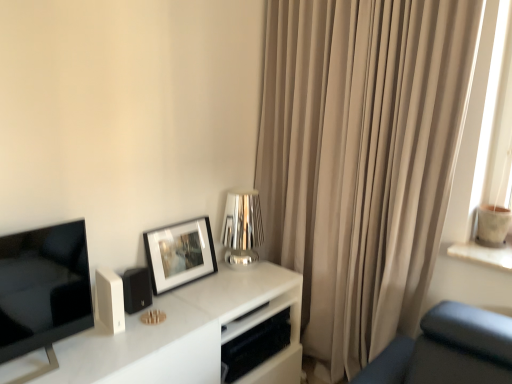
Question: Could you tell me if shiny metallic table lamp at center is facing white marble tv stand at center?

Choices:
 (A) yes
 (B) no

Answer: (B)

Question: Does shiny metallic table lamp at center have a greater width compared to white marble tv stand at center?

Choices:
 (A) yes
 (B) no

Answer: (B)

Question: Does shiny metallic table lamp at center appear on the left side of white marble tv stand at center?

Choices:
 (A) yes
 (B) no

Answer: (B)

Question: Is white marble tv stand at center completely or partially inside shiny metallic table lamp at center?

Choices:
 (A) no
 (B) yes

Answer: (A)

Question: From the image's perspective, does shiny metallic table lamp at center appear lower than white marble tv stand at center?

Choices:
 (A) yes
 (B) no

Answer: (B)

Question: Is white marble tv stand at center taller or shorter than beige fabric curtain at right?

Choices:
 (A) tall
 (B) short

Answer: (B)

Question: From a real-world perspective, is white marble tv stand at center positioned above or below beige fabric curtain at right?

Choices:
 (A) above
 (B) below

Answer: (B)

Question: From the image's perspective, is white marble tv stand at center positioned above or below beige fabric curtain at right?

Choices:
 (A) above
 (B) below

Answer: (B)

Question: Is white marble tv stand at center in front of or behind beige fabric curtain at right in the image?

Choices:
 (A) front
 (B) behind

Answer: (A)

Question: Visually, is matte black picture frame at center left positioned to the left or to the right of beige fabric curtain at right?

Choices:
 (A) right
 (B) left

Answer: (B)

Question: Is matte black picture frame at center left inside the boundaries of beige fabric curtain at right, or outside?

Choices:
 (A) inside
 (B) outside

Answer: (B)

Question: From the image's perspective, is matte black picture frame at center left above or below beige fabric curtain at right?

Choices:
 (A) above
 (B) below

Answer: (B)

Question: Relative to beige fabric curtain at right, is matte black picture frame at center left in front or behind?

Choices:
 (A) behind
 (B) front

Answer: (A)

Question: Is point click(x=96, y=306) closer or farther from the camera than point click(x=140, y=306)?

Choices:
 (A) farther
 (B) closer

Answer: (B)

Question: From the image's perspective, is white plastic speaker at lower left above or below matte black speaker at lower left?

Choices:
 (A) below
 (B) above

Answer: (A)